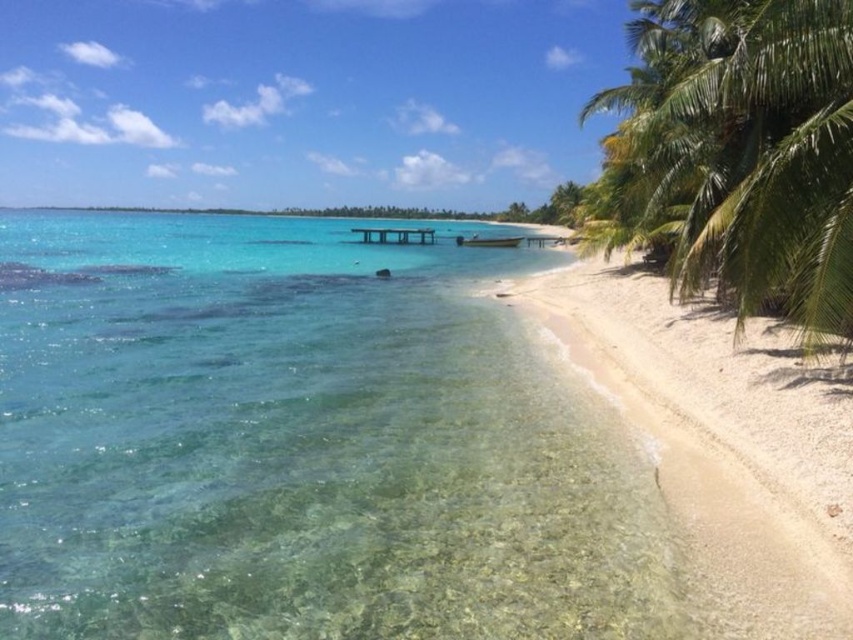
You are standing at the beach and want to walk from point A to point B. Point A is at coordinates point (376,326) and point B is at point (737,278). Considering the beach terrain, will you walk uphill or downhill from point A to point B?

Since point (376,326) is behind point (737,278), it means you are walking uphill from point A to point B.

You are a photographer planning to capture the beach scene. You want to ensure that both the clear glassy water at center and the green leafy palm tree at right are visible in your shot. Which object will occupy a larger portion of the photo?

The clear glassy water at center will occupy a larger portion of the photo because it is bigger than the green leafy palm tree at right according to the description.